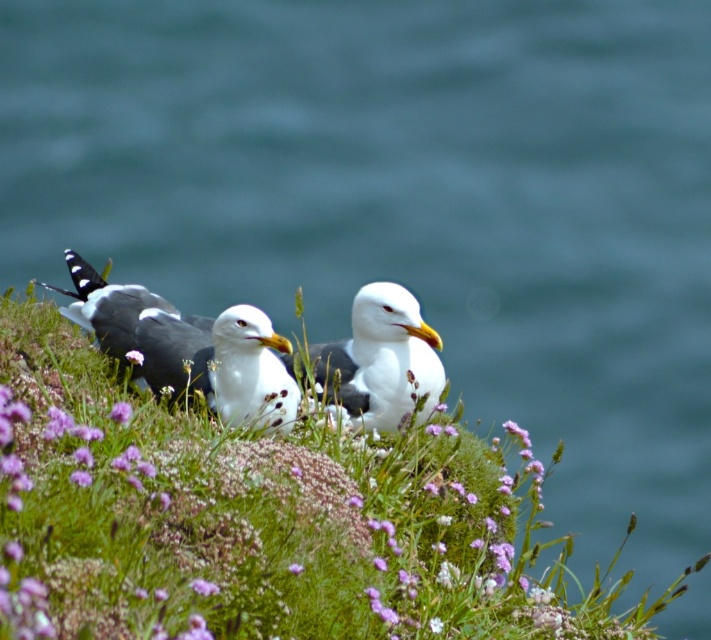
You are a birdwatcher observing the scene from a distance. You notice the white speckled feathers at center and the purple matte flower at center. If you want to take a photo that includes both objects in the frame, what is the minimum distance you need to maintain between them to ensure they are both clearly visible?

The minimum distance you need to maintain between the white speckled feathers at center and the purple matte flower at center is 13.45 inches to ensure both are clearly visible in the photo.

You are an ornithologist observing the coastal scene. You notice the white speckled feathers at center and the purple matte flower at center. Which object occupies more horizontal space in the image?

The white speckled feathers at center occupies more horizontal space than the purple matte flower at center because its width is larger according to the description.